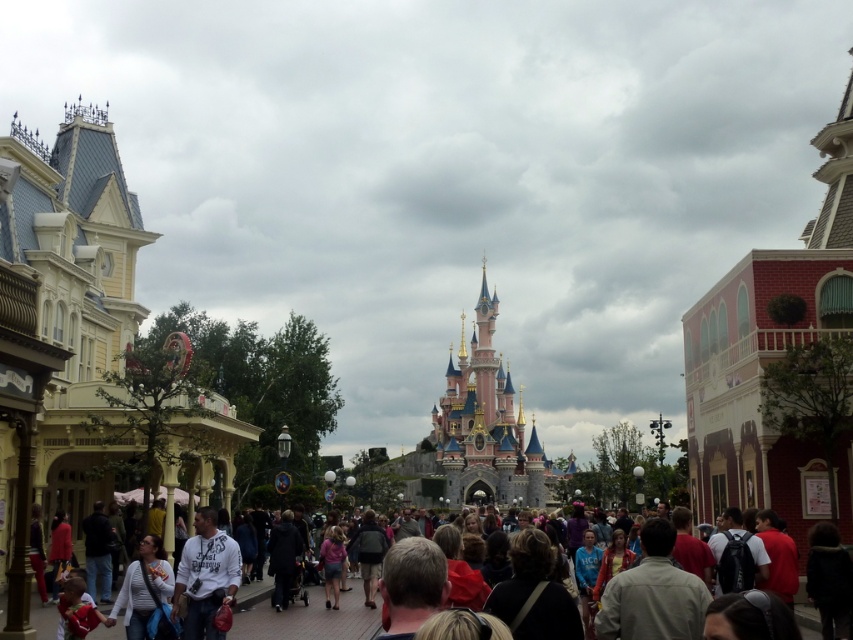
Can you confirm if dark blue jacket at center is bigger than matte black backpack at center?

No.

This screenshot has height=640, width=853. Identify the location of dark blue jacket at center. (283, 557).

This screenshot has width=853, height=640. What do you see at coordinates (283, 557) in the screenshot?
I see `dark blue jacket at center` at bounding box center [283, 557].

This screenshot has height=640, width=853. I want to click on dark blue jacket at center, so click(x=283, y=557).

Does pink glossy castle at center appear under dark brown leather jacket at center?

Incorrect, pink glossy castle at center is not positioned below dark brown leather jacket at center.

Measure the distance between point (492, 305) and camera.

Point (492, 305) is 710.51 feet away from camera.

You are a GUI agent. You are given a task and a screenshot of the screen. Output one action in this format:
    pyautogui.click(x=<x>, y=<y>)
    Task: Click on the pink glossy castle at center
    
    Given the screenshot: What is the action you would take?
    pyautogui.click(x=479, y=433)

Is dark brown leather jacket at center below dark blue jacket at center?

Incorrect, dark brown leather jacket at center is not positioned below dark blue jacket at center.

Does dark brown leather jacket at center lie in front of dark blue jacket at center?

Yes, dark brown leather jacket at center is in front of dark blue jacket at center.

Consider the image. Who is more distant from viewer, (x=508, y=593) or (x=271, y=573)?

The point (x=271, y=573) is more distant.

You are a GUI agent. You are given a task and a screenshot of the screen. Output one action in this format:
    pyautogui.click(x=<x>, y=<y>)
    Task: Click on the dark brown leather jacket at center
    
    Given the screenshot: What is the action you would take?
    pyautogui.click(x=532, y=593)